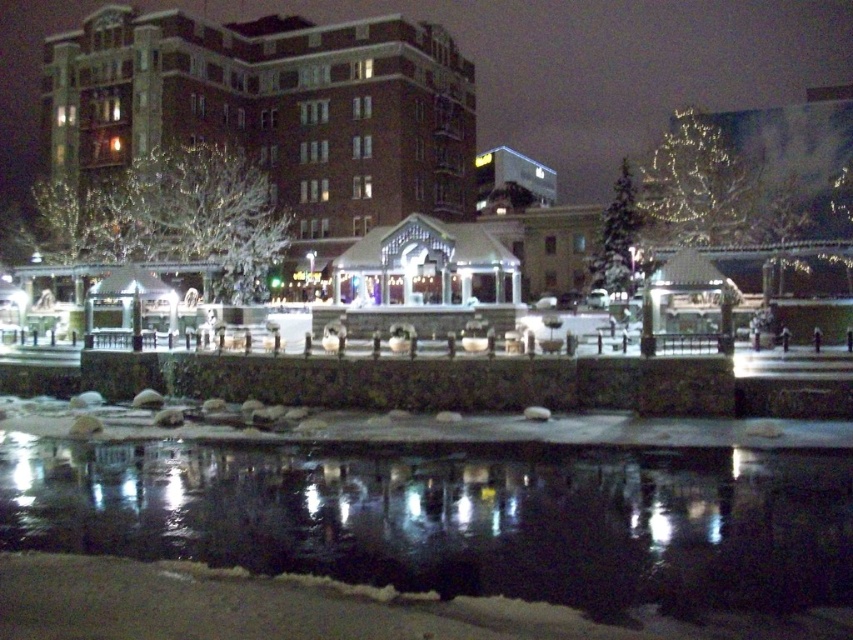
Looking at this image, you are a photographer planning to capture the entire scene in one shot. Given that the black reflective water at lower center and the brick building at upper center must both be visible, which object should be placed closer to the edge of the frame to ensure both fit in the composition?

The black reflective water at lower center should be placed closer to the edge of the frame because it is thinner than the brick building at upper center, allowing more space for the wider building while still including both in the shot.

You are a photographer planning to capture the entire scene in one shot. Given that the black reflective water at lower center and the brick building at upper center are both in your frame, which object takes up more area in your photo?

The brick building at upper center occupies more space than the black reflective water at lower center in the photo.